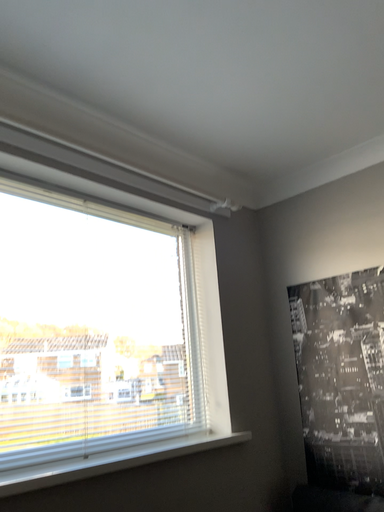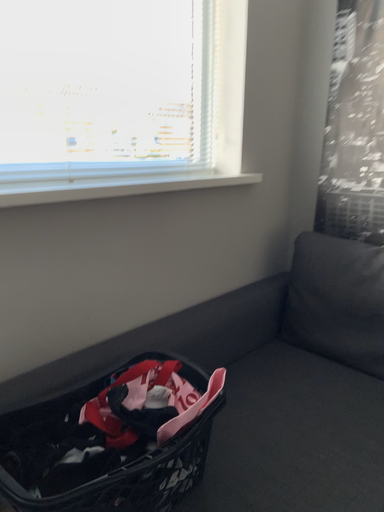
Question: How did the camera likely rotate when shooting the video?

Choices:
 (A) rotated upward
 (B) rotated downward

Answer: (B)